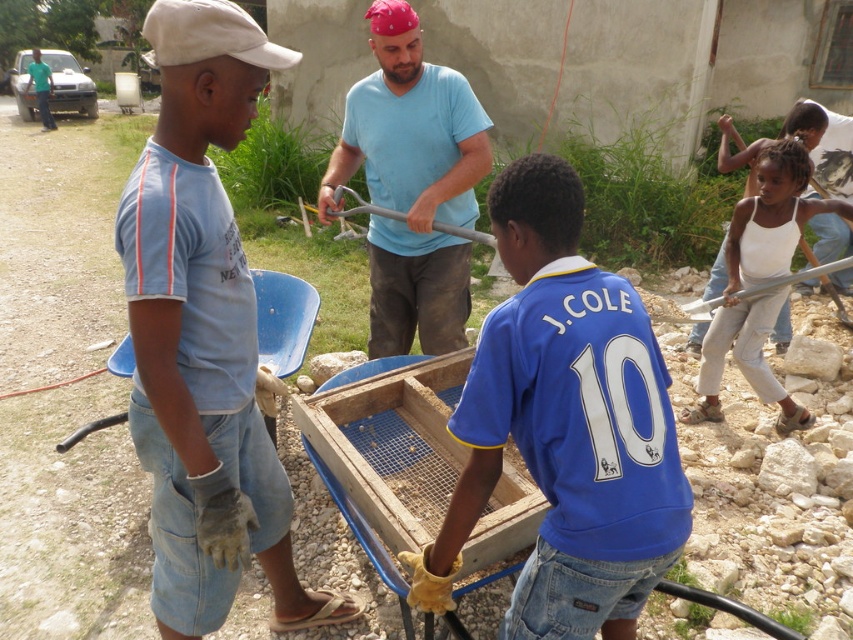
Between point (438, 548) and point (776, 154), which one is positioned behind?

Point (776, 154)

This screenshot has width=853, height=640. Describe the element at coordinates (564, 426) in the screenshot. I see `blue jersey at center` at that location.

Does point (450, 524) lie behind point (793, 248)?

That is False.

The width and height of the screenshot is (853, 640). Find the location of `blue jersey at center`. blue jersey at center is located at coordinates (564, 426).

Measure the distance between point (454,291) and camera.

Point (454,291) and camera are 11.95 feet apart from each other.

Does blue cotton shirt at center have a greater height compared to white cotton tank top at right?

In fact, blue cotton shirt at center may be shorter than white cotton tank top at right.

Which is in front, point (387, 13) or point (773, 291)?

Positioned in front is point (387, 13).

What are the coordinates of `blue cotton shirt at center` in the screenshot? It's located at (412, 184).

Does light blue t-shirt at left have a lesser height compared to white cotton tank top at right?

Incorrect, light blue t-shirt at left's height does not fall short of white cotton tank top at right's.

Can you confirm if light blue t-shirt at left is bigger than white cotton tank top at right?

Indeed, light blue t-shirt at left has a larger size compared to white cotton tank top at right.

Which is in front, point (177, 180) or point (793, 170)?

Point (177, 180)

This screenshot has width=853, height=640. I want to click on light blue t-shirt at left, so click(204, 336).